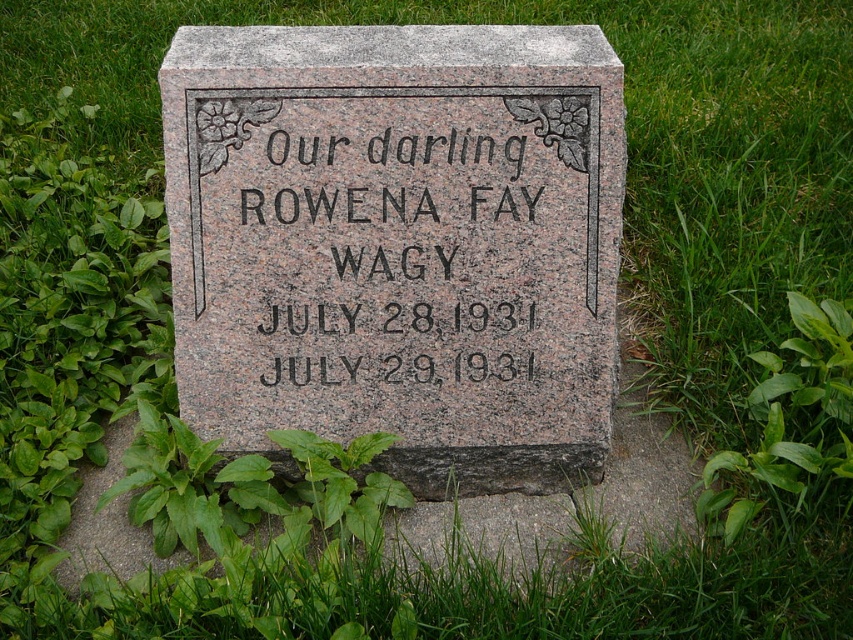
You are visiting a cemetery and notice the granite gravestone at center and the green leafy plant at lower right. Which object is taller?

The granite gravestone at center is taller than the green leafy plant at lower right.